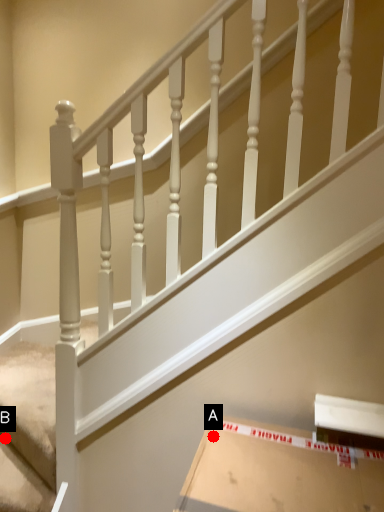
Question: Two points are circled on the image, labeled by A and B beside each circle. Which point appears farthest from the camera in this image?

Choices:
 (A) A is further
 (B) B is further

Answer: (B)